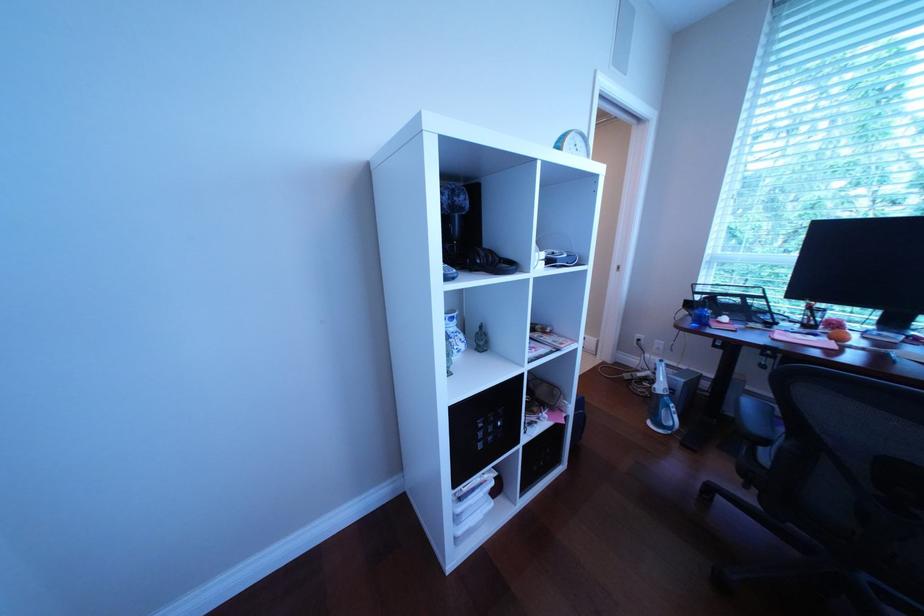
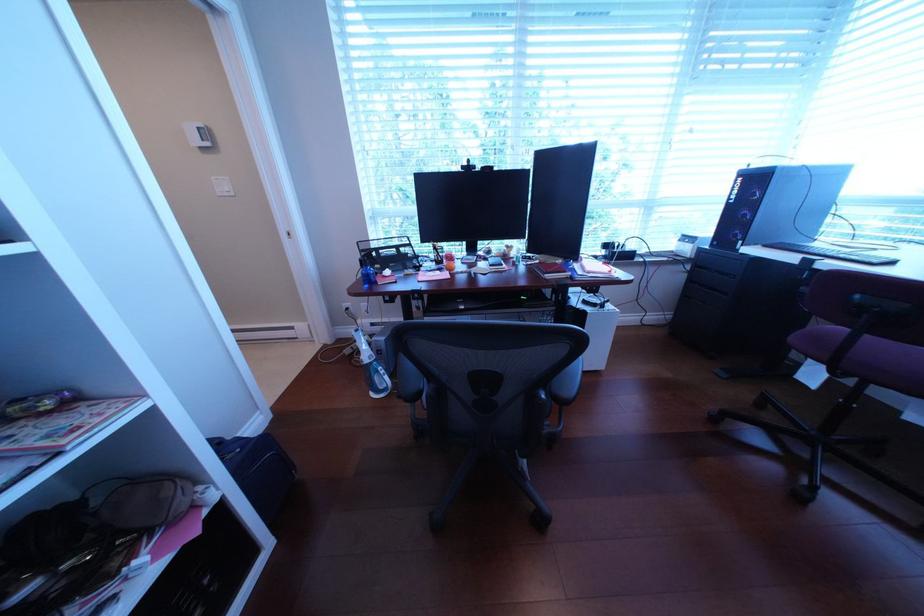
Question: The camera is either moving clockwise (left) or counter-clockwise (right) around the object. The first image is from the beginning of the video and the second image is from the end. Is the camera moving left or right when shooting the video?

Choices:
 (A) Left
 (B) Right

Answer: (A)